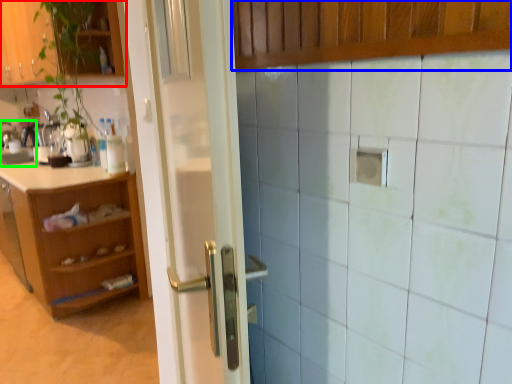
Question: Estimate the real-world distances between objects in this image. Which object is farther from cabinetry (highlighted by a red box), cabinetry (highlighted by a blue box) or sink (highlighted by a green box)?

Choices:
 (A) cabinetry
 (B) sink

Answer: (A)